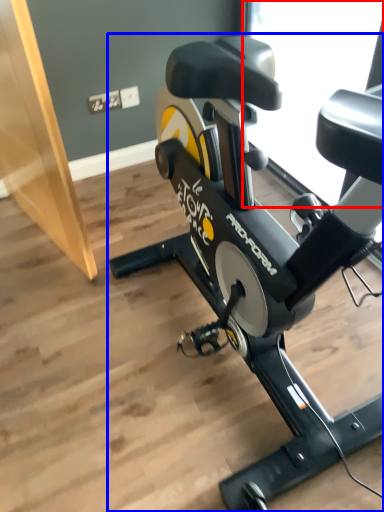
Question: Which object is closer to the camera taking this photo, window screen (highlighted by a red box) or stationary bicycle (highlighted by a blue box)?

Choices:
 (A) window screen
 (B) stationary bicycle

Answer: (B)